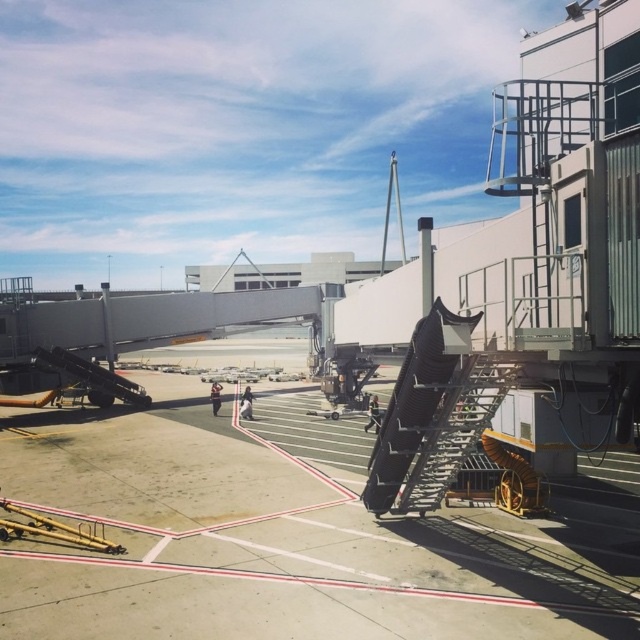
Question: Can you confirm if metallic gray tarmac at center is positioned to the left of metallic staircase at right?

Choices:
 (A) yes
 (B) no

Answer: (A)

Question: Which object is farther from the camera taking this photo?

Choices:
 (A) metallic gray tarmac at center
 (B) metallic staircase at right

Answer: (B)

Question: Does metallic gray tarmac at center appear on the left side of metallic staircase at right?

Choices:
 (A) no
 (B) yes

Answer: (B)

Question: Which point is farther from the camera taking this photo?

Choices:
 (A) (451, 444)
 (B) (260, 516)

Answer: (B)

Question: Can you confirm if metallic gray tarmac at center is thinner than metallic staircase at right?

Choices:
 (A) no
 (B) yes

Answer: (A)